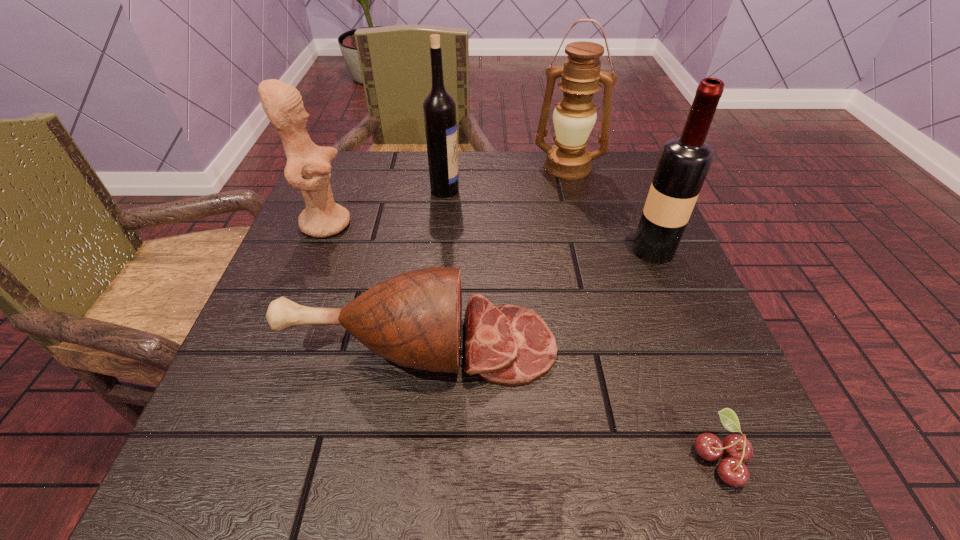
The height and width of the screenshot is (540, 960). Identify the location of object positioned at the near edge. (732, 470).

Image resolution: width=960 pixels, height=540 pixels. In order to click on figurine present at the left edge in this screenshot , I will do `click(308, 166)`.

I want to click on ham positioned at the left edge, so click(x=413, y=319).

Find the location of a particular element. This screenshot has height=540, width=960. oil lamp located at the right edge is located at coordinates (575, 115).

Image resolution: width=960 pixels, height=540 pixels. Identify the location of wine bottle situated at the right edge. (684, 162).

This screenshot has width=960, height=540. I want to click on cherry at the right edge, so click(x=732, y=470).

Find the location of a particular element. Image resolution: width=960 pixels, height=540 pixels. object located in the far left corner section of the desktop is located at coordinates (308, 166).

Identify the location of object positioned at the far right corner. (575, 115).

Where is `object that is positioned at the near right corner`? The height and width of the screenshot is (540, 960). object that is positioned at the near right corner is located at coordinates (732, 470).

Locate an element on the screen. vacant space at the far edge of the desktop is located at coordinates (462, 167).